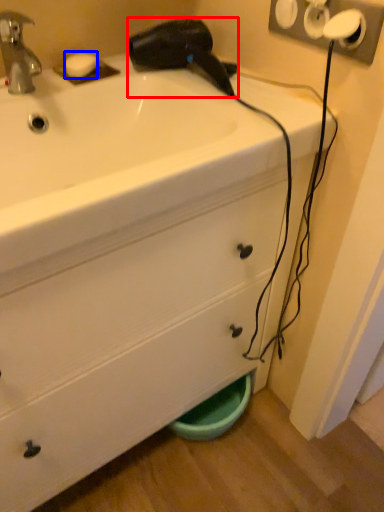
Question: Which object appears farthest to the camera in this image, hair drier (highlighted by a red box) or soap (highlighted by a blue box)?

Choices:
 (A) hair drier
 (B) soap

Answer: (B)